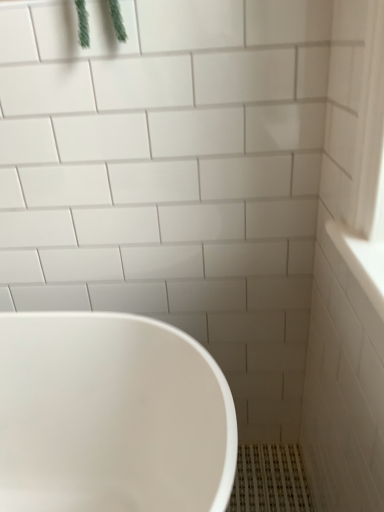
Measure the distance between point (x=83, y=48) and camera.

Point (x=83, y=48) is 32.17 inches from camera.

Find the location of a particular element. green matte plant at upper left is located at coordinates (83, 24).

The height and width of the screenshot is (512, 384). Describe the element at coordinates (83, 24) in the screenshot. I see `green matte plant at upper left` at that location.

The image size is (384, 512). Identify the location of green matte plant at upper left. (83, 24).